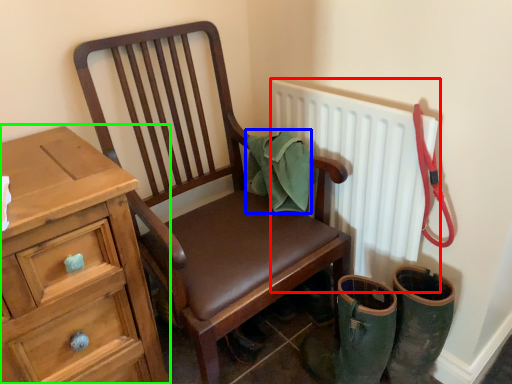
Question: Estimate the real-world distances between objects in this image. Which object is farther from radiator (highlighted by a red box), material (highlighted by a blue box) or chest of drawers (highlighted by a green box)?

Choices:
 (A) material
 (B) chest of drawers

Answer: (B)